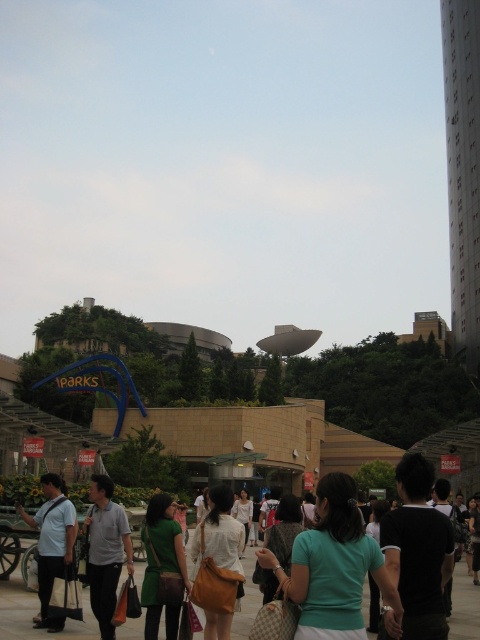
Does green fabric crowd at center appear over matte white shirt at center?

No.

Can you confirm if green fabric crowd at center is taller than matte white shirt at center?

Yes.

Image resolution: width=480 pixels, height=640 pixels. Find the location of `green fabric crowd at center`. green fabric crowd at center is located at coordinates [x=33, y=612].

Who is lower down, green fabric crowd at center or matte green dress at center?

green fabric crowd at center is below.

Between green fabric crowd at center and matte green dress at center, which one appears on the right side from the viewer's perspective?

Positioned to the right is green fabric crowd at center.

Identify the location of green fabric crowd at center. (33, 612).

Which of these two, matte green dress at center or matte white shirt at center, stands taller?

With more height is matte white shirt at center.

Does matte green dress at center have a lesser width compared to matte white shirt at center?

No.

Who is more distant from viewer, (183, 554) or (226, 632)?

The point (183, 554) is more distant.

Where is `matte green dress at center`? Image resolution: width=480 pixels, height=640 pixels. matte green dress at center is located at coordinates (163, 566).